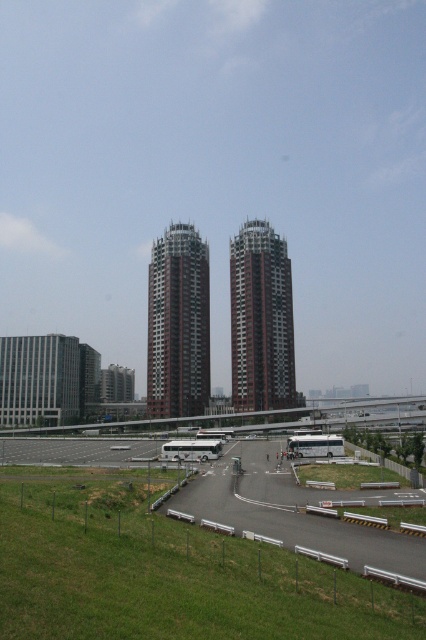
Question: Does white concrete race track at lower center appear on the left side of red brick building at center?

Choices:
 (A) yes
 (B) no

Answer: (B)

Question: Can you confirm if red brick building at center is positioned to the right of brown textured building at center?

Choices:
 (A) yes
 (B) no

Answer: (B)

Question: Which object is the closest to the white concrete race track at lower center?

Choices:
 (A) brown textured building at center
 (B) red brick building at center

Answer: (A)

Question: Considering the real-world distances, which object is farthest from the red brick building at center?

Choices:
 (A) brown textured building at center
 (B) white concrete race track at lower center

Answer: (B)

Question: Does red brick building at center appear over brown textured building at center?

Choices:
 (A) no
 (B) yes

Answer: (A)

Question: Among these objects, which one is farthest from the camera?

Choices:
 (A) white concrete race track at lower center
 (B) brown textured building at center
 (C) red brick building at center

Answer: (C)